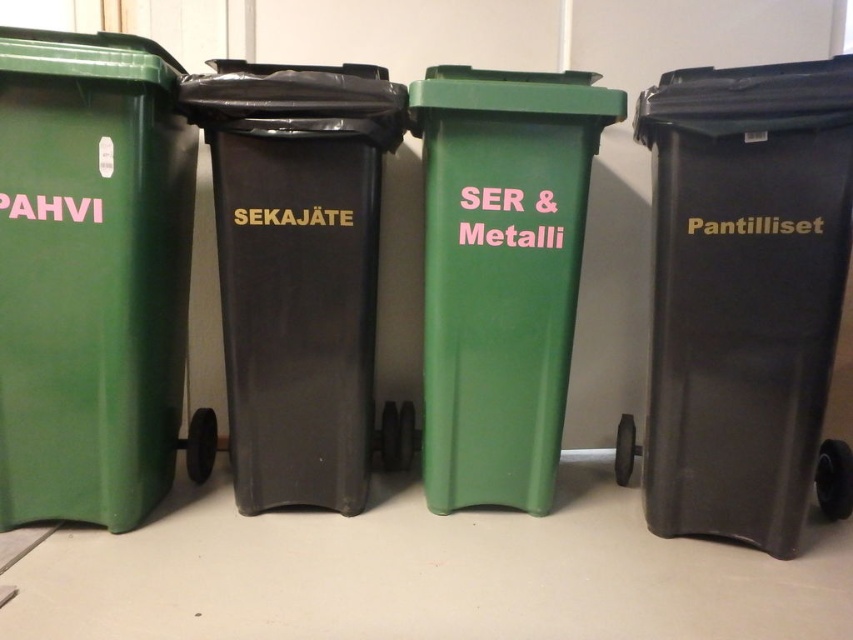
You are standing at the center of the image. Which direction should you move to reach the black plastic recycling bin at right?

The black plastic recycling bin at right is located at point (744, 298), so you should move towards the right side of the image to reach it.

You are a delivery person who just arrived at the location and need to place a package into the correct bin. The package contains a broken plastic toy. Which bin should you use, and will the package fit between the black plastic recycling bin at right and the green matte recycling bin at center?

The broken plastic toy should be placed in the black plastic recycling bin at right. The distance between the black plastic recycling bin at right and the green matte recycling bin at center is 9.73 inches, so the package will fit between them if it is smaller than that distance.

You are standing 1.5 meters away from the green plastic pahvi at left. You want to throw away a coffee filter. Which bin should you use?

The green plastic pahvi at left is designated for coffee grounds or similar organic waste, so you should use the green plastic pahvi at left.